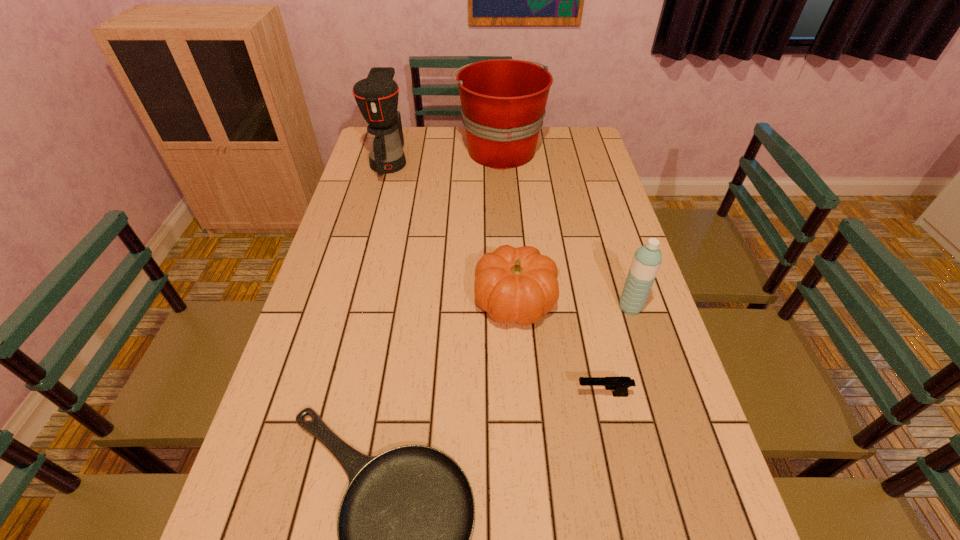
Identify the location of vacant area between the bucket and the coffee maker. (444, 156).

Select which object appears as the second closest to the second shortest object. Please provide its 2D coordinates. Your answer should be formatted as a tuple, i.e. [(x, y)], where the tuple contains the x and y coordinates of a point satisfying the conditions above.

[(647, 259)]

Where is `the third closest object to the coffee maker`? The image size is (960, 540). the third closest object to the coffee maker is located at coordinates (647, 259).

Identify the location of free space that satisfies the following two spatial constraints: 1. pour from the carafe of the rightmost object; 2. on the right side of the coffee maker. The height and width of the screenshot is (540, 960). (350, 307).

The height and width of the screenshot is (540, 960). In order to click on free spot that satisfies the following two spatial constraints: 1. on the front side of the bucket; 2. on the right side of the third tallest object in this screenshot , I will do 510,307.